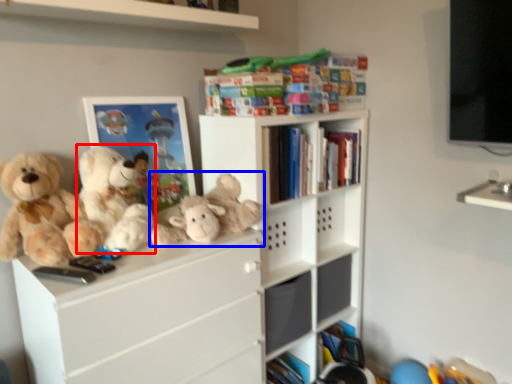
Question: Which object appears closest to the camera in this image, teddy bear (highlighted by a red box) or toy (highlighted by a blue box)?

Choices:
 (A) teddy bear
 (B) toy

Answer: (A)